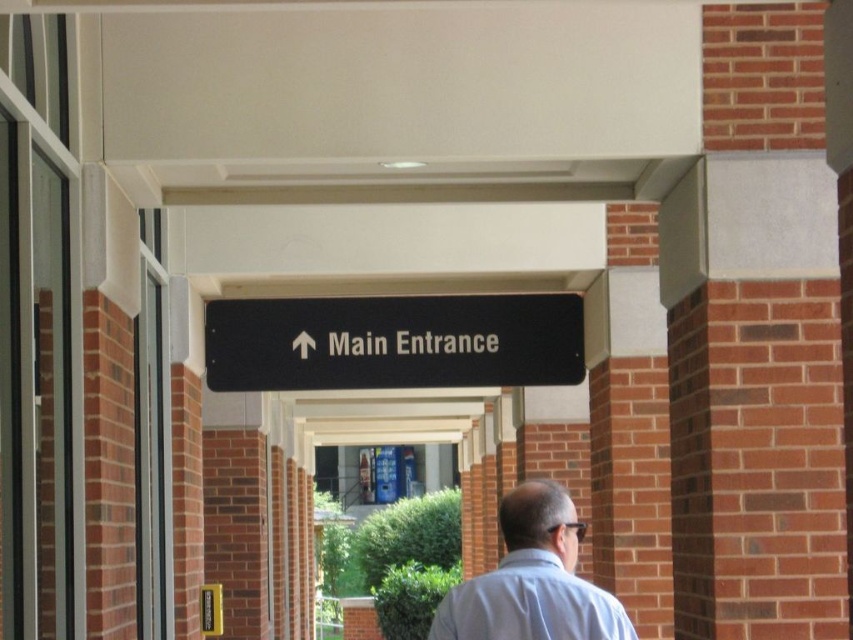
Looking at this image, measure the distance between point (518, 385) and camera.

The distance of point (518, 385) from camera is 7.21 meters.

Is black plastic sign at center shorter than light blue shirt at center?

No, black plastic sign at center is not shorter than light blue shirt at center.

Which is behind, point (370, 352) or point (491, 572)?

The point (370, 352) is more distant.

At what (x,y) coordinates should I click in order to perform the action: click on black plastic sign at center. Please return your answer as a coordinate pair (x, y). Looking at the image, I should click on (393, 342).